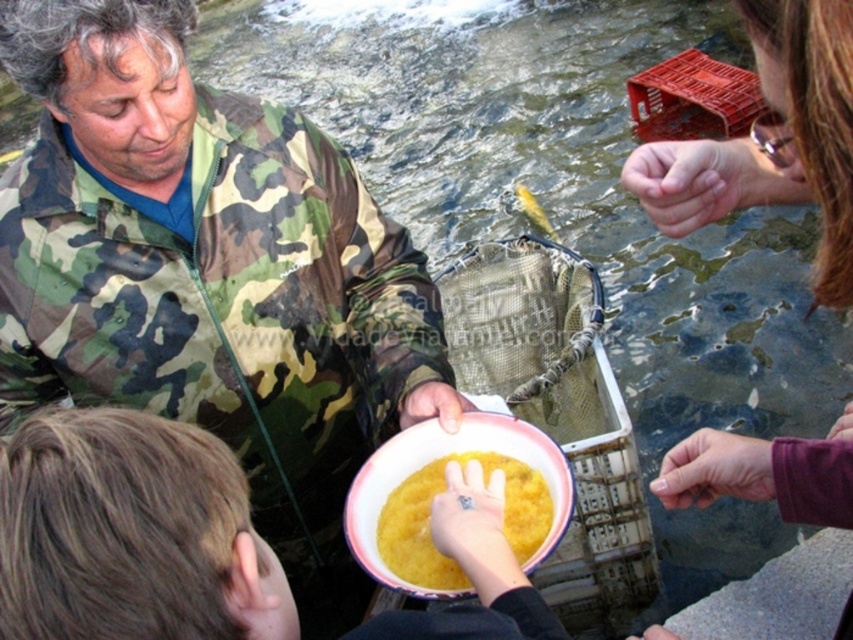
You are a photographer trying to capture the scene where the matte green camouflage jacket at center and the yellow shiny fish at center are both visible. Based on their heights, which object should you focus on first to ensure both are in frame?

The matte green camouflage jacket at center is not as tall as the yellow shiny fish at center, so you should focus on the taller yellow shiny fish at center first to ensure both are in frame.